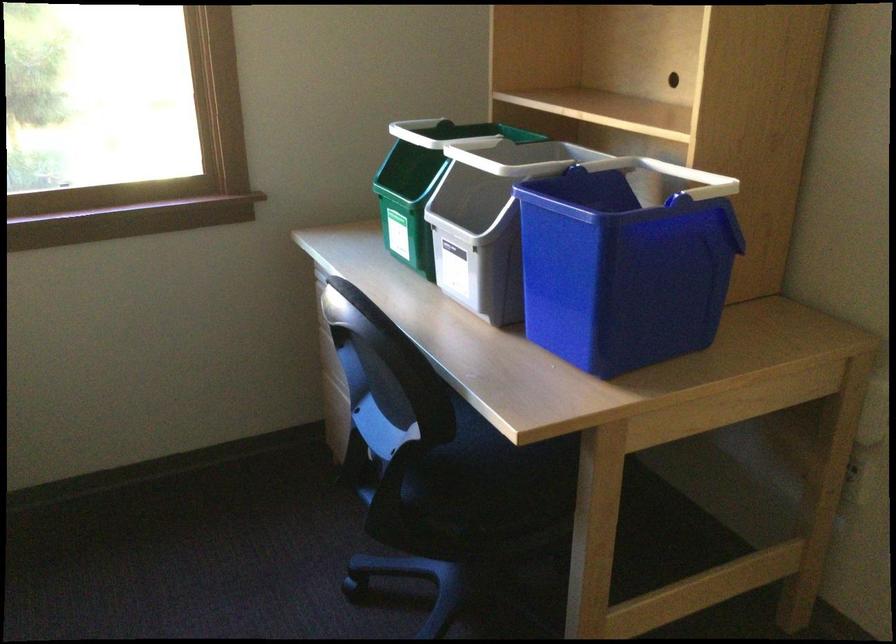
This screenshot has height=644, width=896. Describe the element at coordinates (487, 221) in the screenshot. I see `the grey recycling bin` at that location.